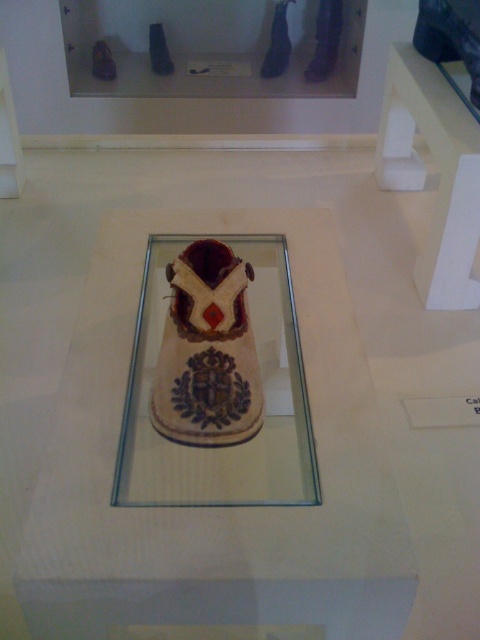
Looking at this image, between transparent glass at center and white matte table at upper right, which one has less height?

Standing shorter between the two is transparent glass at center.

Locate an element on the screen. The width and height of the screenshot is (480, 640). transparent glass at center is located at coordinates (216, 380).